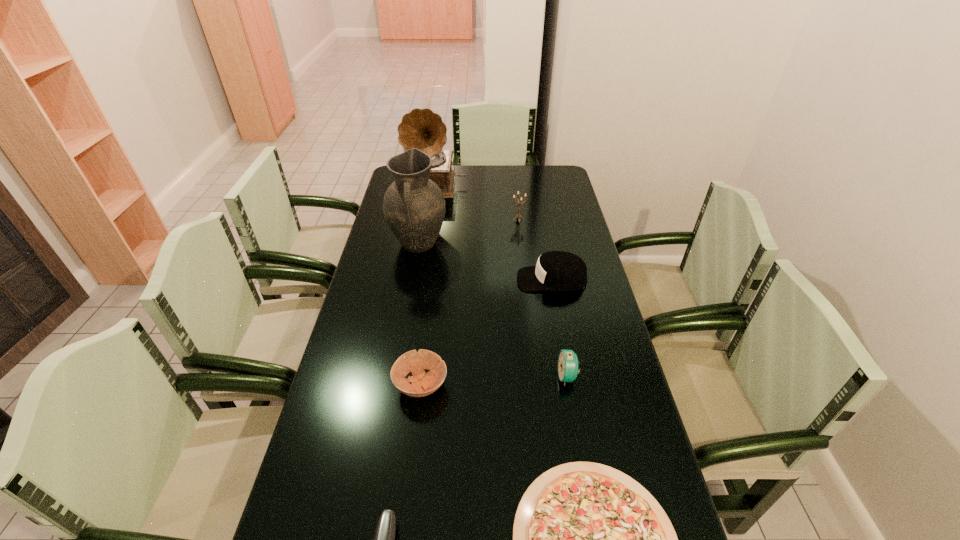
The width and height of the screenshot is (960, 540). Identify the location of cap that is at the right edge. (555, 270).

At what (x,y) coordinates should I click in order to perform the action: click on alarm clock that is at the right edge. Please return your answer as a coordinate pair (x, y). Image resolution: width=960 pixels, height=540 pixels. Looking at the image, I should click on (568, 362).

Identify the location of object at the far left corner. (422, 129).

Locate an element on the screen. vacant space at the far edge is located at coordinates (456, 181).

Locate an element on the screen. Image resolution: width=960 pixels, height=540 pixels. free space at the left edge of the desktop is located at coordinates (323, 506).

In order to click on vacant space at the right edge of the desktop in this screenshot , I will do tap(547, 234).

This screenshot has width=960, height=540. I want to click on unoccupied area between the cap and the alarm clock, so click(x=560, y=328).

At what (x,y) coordinates should I click in order to perform the action: click on free space between the record player and the fourth farthest object. Please return your answer as a coordinate pair (x, y). Looking at the image, I should click on (493, 232).

The height and width of the screenshot is (540, 960). What are the coordinates of `unoccupied position between the cap and the record player` in the screenshot? It's located at (493, 232).

Find the location of `vacant space that is in between the sixth shortest object and the bowl`. vacant space that is in between the sixth shortest object and the bowl is located at coordinates (469, 302).